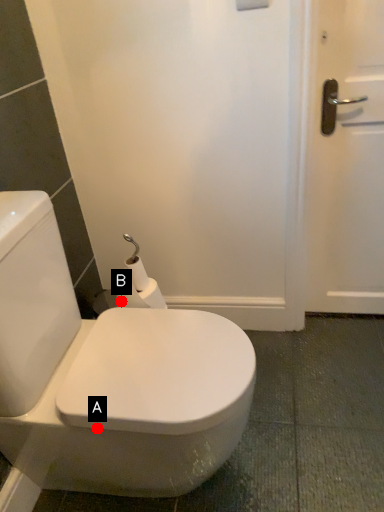
Question: Two points are circled on the image, labeled by A and B beside each circle. Which point is closer to the camera taking this photo?

Choices:
 (A) A is closer
 (B) B is closer

Answer: (A)